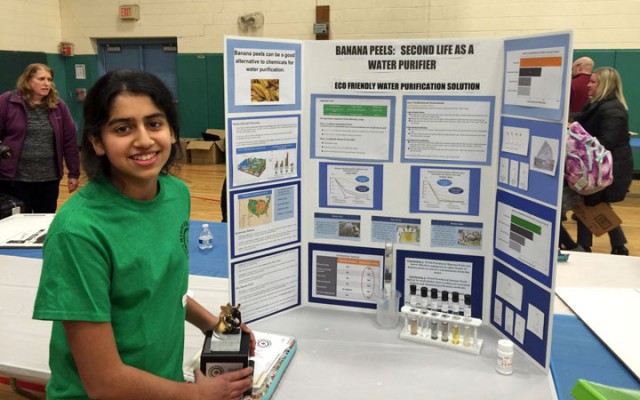
Locate an element on the screen. white wooden wall with horizontal tiles is located at coordinates (188, 10).